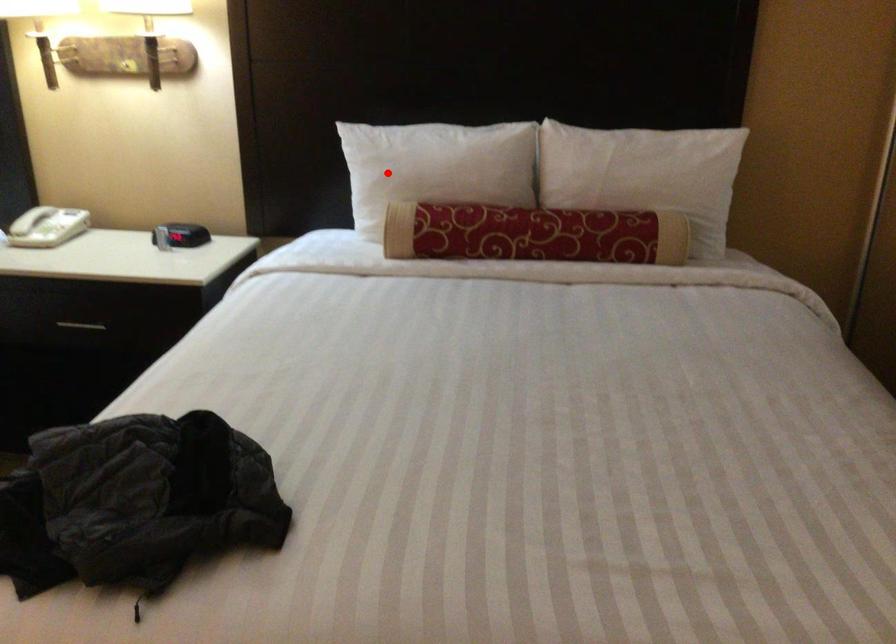
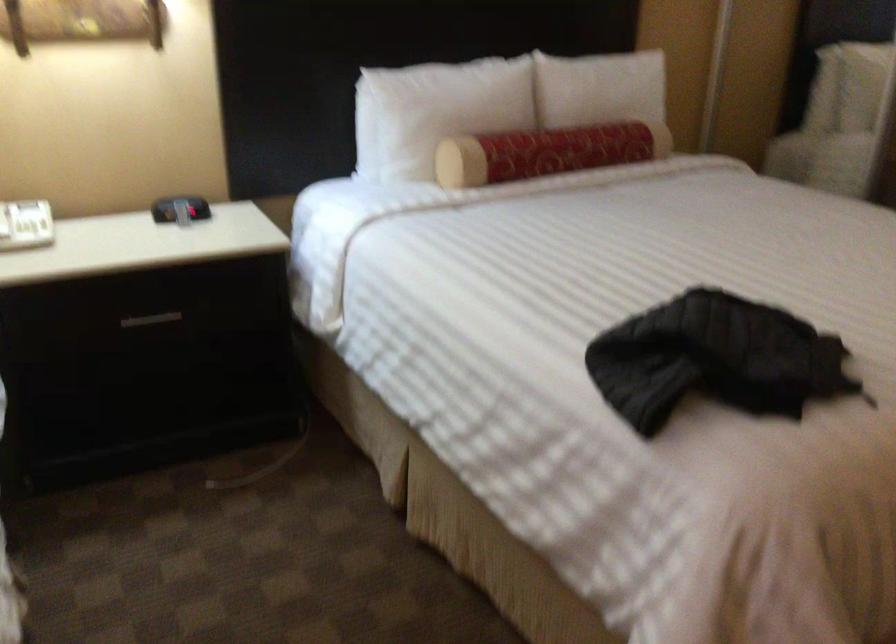
The point at the highlighted location is marked in the first image. Where is the corresponding point in the second image?

(435, 111)